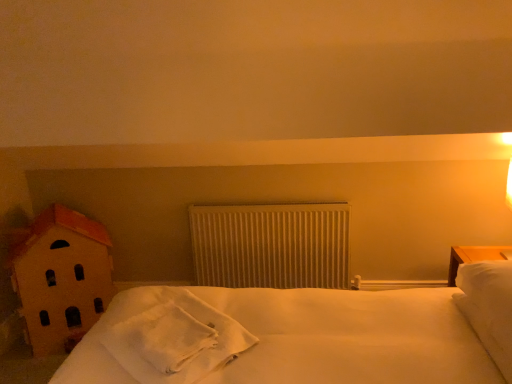
Question: Is white soft towel at center closer to camera compared to wooden house at left?

Choices:
 (A) yes
 (B) no

Answer: (A)

Question: Is white soft towel at center to the right of wooden house at left from the viewer's perspective?

Choices:
 (A) yes
 (B) no

Answer: (A)

Question: Is wooden house at left located within white soft towel at center?

Choices:
 (A) no
 (B) yes

Answer: (A)

Question: Does white soft towel at center have a smaller size compared to wooden house at left?

Choices:
 (A) no
 (B) yes

Answer: (B)

Question: Is the position of white soft towel at center more distant than that of wooden house at left?

Choices:
 (A) yes
 (B) no

Answer: (B)

Question: From the image's perspective, is white soft pillow at right positioned above or below white textured radiator at center?

Choices:
 (A) above
 (B) below

Answer: (B)

Question: Is point [502, 321] closer or farther from the camera than point [236, 254]?

Choices:
 (A) closer
 (B) farther

Answer: (A)

Question: Considering their positions, is white soft pillow at right located in front of or behind white textured radiator at center?

Choices:
 (A) front
 (B) behind

Answer: (A)

Question: Considering the relative positions of white soft pillow at right and white textured radiator at center in the image provided, is white soft pillow at right to the left or to the right of white textured radiator at center?

Choices:
 (A) right
 (B) left

Answer: (A)

Question: From a real-world perspective, is white textured radiator at center physically located above or below white soft pillow at right?

Choices:
 (A) above
 (B) below

Answer: (B)

Question: Considering the positions of white textured radiator at center and white soft pillow at right in the image, is white textured radiator at center bigger or smaller than white soft pillow at right?

Choices:
 (A) big
 (B) small

Answer: (B)

Question: In terms of width, does white textured radiator at center look wider or thinner when compared to white soft pillow at right?

Choices:
 (A) wide
 (B) thin

Answer: (B)

Question: Is point (225, 281) positioned closer to the camera than point (501, 345)?

Choices:
 (A) farther
 (B) closer

Answer: (A)

Question: From the image's perspective, is white soft towel at center located above or below wooden house at left?

Choices:
 (A) above
 (B) below

Answer: (B)

Question: In the image, is white soft towel at center positioned in front of or behind wooden house at left?

Choices:
 (A) front
 (B) behind

Answer: (A)